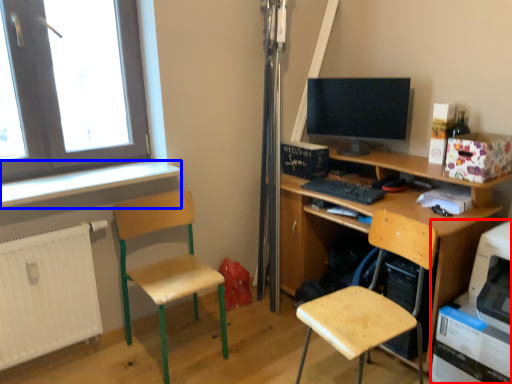
Question: Which object is further to the camera taking this photo, printer (highlighted by a red box) or window sill (highlighted by a blue box)?

Choices:
 (A) printer
 (B) window sill

Answer: (B)